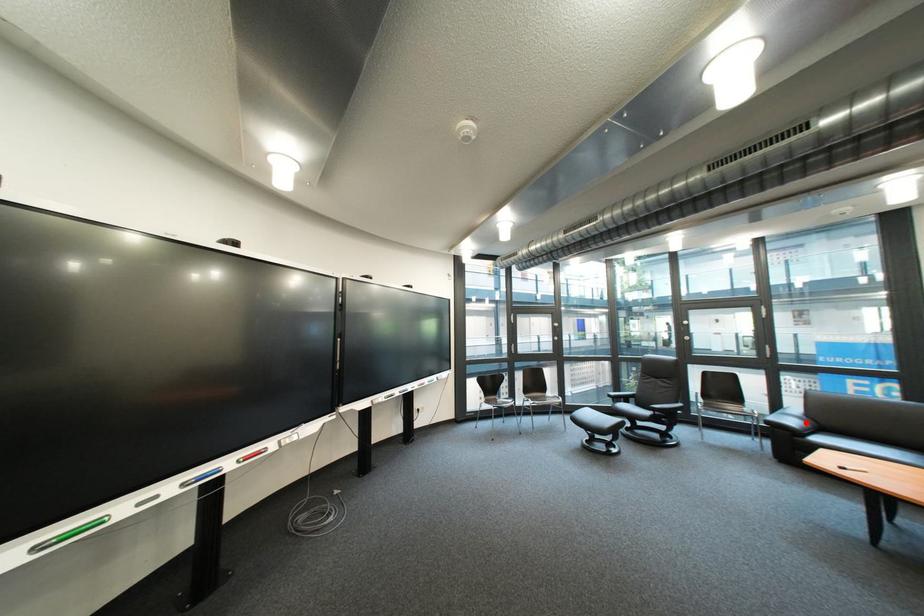
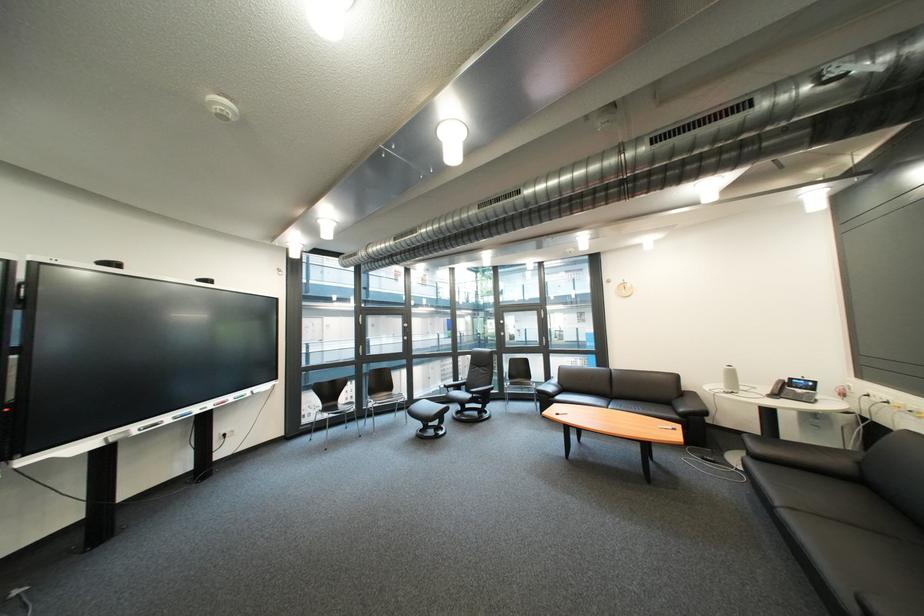
Question: I am providing you with two images of the same scene from different viewpoints. A red point is marked on the first image. Can you still see the location of the red point in image 2?

Choices:
 (A) Yes
 (B) No

Answer: (B)